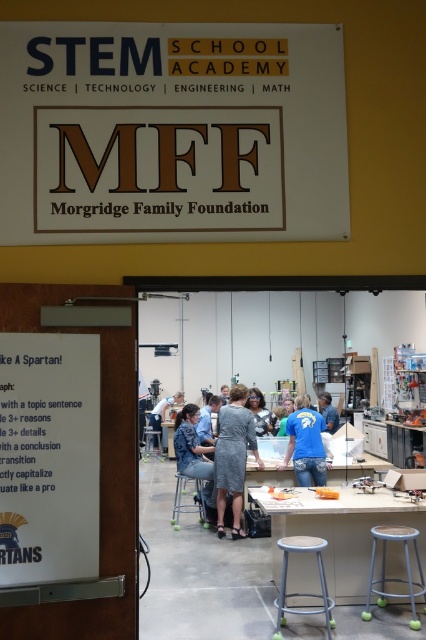
You are a student who needs to sit down quickly. There are two stools available in the STEM school environment described. Which stool, the metallic stool at center or the metallic silver stool at center, takes up less space and would be easier to move around?

The metallic stool at center occupies less space than the metallic silver stool at center, making it easier to move around.

You are standing in the STEM school academy and want to move from the entrance to the workspace beyond the doorway. There are two points marked on the floor at coordinates point (181, 435) and point (400, 596). Which point should you step on first to reach the workspace?

You should step on point (400, 596) first because point (181, 435) is behind it, meaning point (400, 596) is closer to the entrance and on the path towards the workspace.

You are standing in the STEM school academy and want to locate the white matte sign at upper center. According to the scene, where is it positioned relative to the metallic silver stool at center?

The white matte sign at upper center is to the left of the metallic silver stool at center.